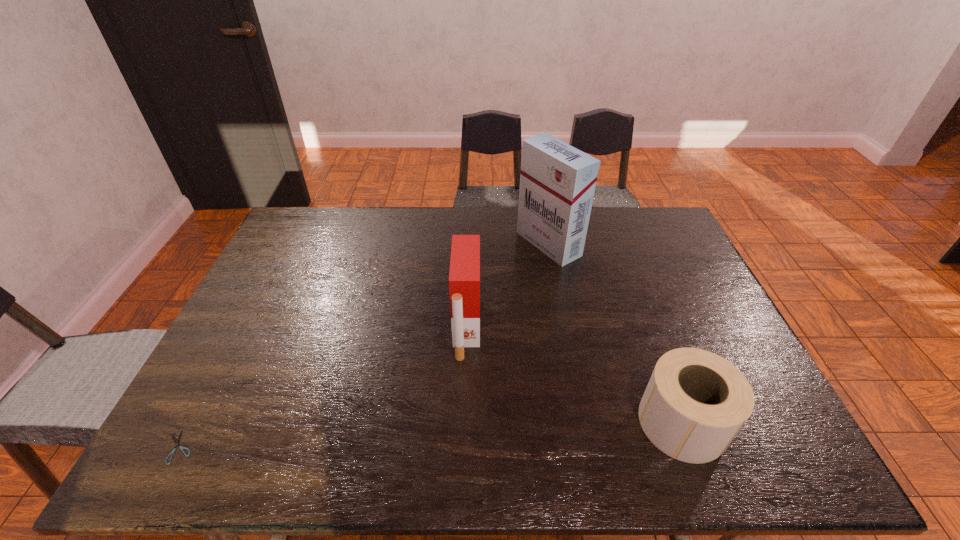
This screenshot has height=540, width=960. Find the location of `the farther cigarette case`. the farther cigarette case is located at coordinates (557, 181).

You are a GUI agent. You are given a task and a screenshot of the screen. Output one action in this format:
    pyautogui.click(x=<x>, y=<y>)
    Task: Click on the tallest object
    
    Given the screenshot: What is the action you would take?
    pyautogui.click(x=557, y=181)

Locate an element on the screen. Image resolution: width=960 pixels, height=540 pixels. the shorter cigarette case is located at coordinates (464, 276).

Image resolution: width=960 pixels, height=540 pixels. Identify the location of the nearer cigarette case. (464, 276).

You are a GUI agent. You are given a task and a screenshot of the screen. Output one action in this format:
    pyautogui.click(x=<x>, y=<y>)
    Task: Click on the second shortest object
    
    Given the screenshot: What is the action you would take?
    pyautogui.click(x=695, y=403)

Locate an element on the screen. Image resolution: width=960 pixels, height=540 pixels. toilet tissue is located at coordinates (695, 403).

Where is `the leftmost object`? the leftmost object is located at coordinates (176, 442).

Image resolution: width=960 pixels, height=540 pixels. What are the coordinates of `the shortest object` in the screenshot? It's located at (176, 442).

Identify the location of blank area located on the left of the right cigarette case. (497, 244).

Where is `vacant space located on the front-facing side of the third shortest object`? vacant space located on the front-facing side of the third shortest object is located at coordinates pos(547,328).